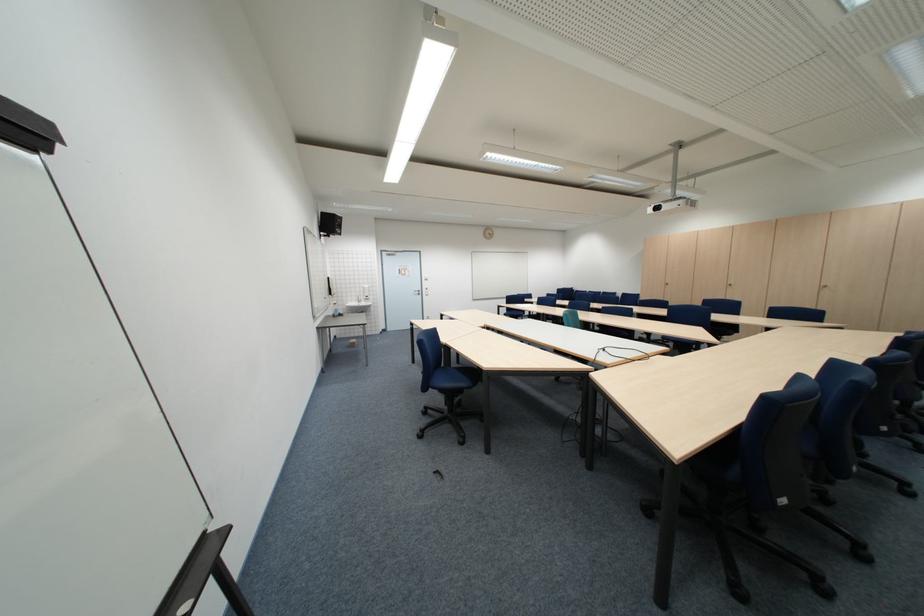
The height and width of the screenshot is (616, 924). What do you see at coordinates (417, 292) in the screenshot?
I see `the silver door handle` at bounding box center [417, 292].